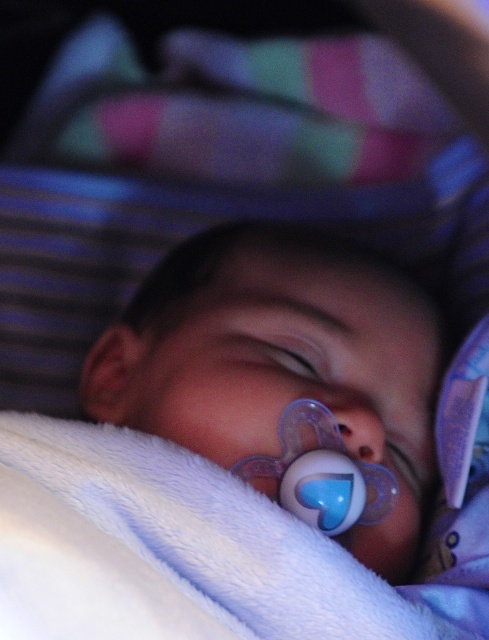
Question: Does translucent plastic pacifier at center have a lesser width compared to transparent plastic pacifier at lower center?

Choices:
 (A) no
 (B) yes

Answer: (A)

Question: Based on their relative distances, which object is farther from the translucent plastic pacifier at center?

Choices:
 (A) transparent plastic pacifier at lower center
 (B) white fluffy blanket at lower left

Answer: (B)

Question: Which is farther from the transparent plastic pacifier at lower center?

Choices:
 (A) translucent plastic pacifier at center
 (B) white fluffy blanket at lower left

Answer: (B)

Question: Is translucent plastic pacifier at center to the left of white fluffy blanket at lower left from the viewer's perspective?

Choices:
 (A) no
 (B) yes

Answer: (A)

Question: Does translucent plastic pacifier at center come in front of white fluffy blanket at lower left?

Choices:
 (A) yes
 (B) no

Answer: (B)

Question: Among these points, which one is farthest from the camera?

Choices:
 (A) (131, 579)
 (B) (429, 461)

Answer: (B)